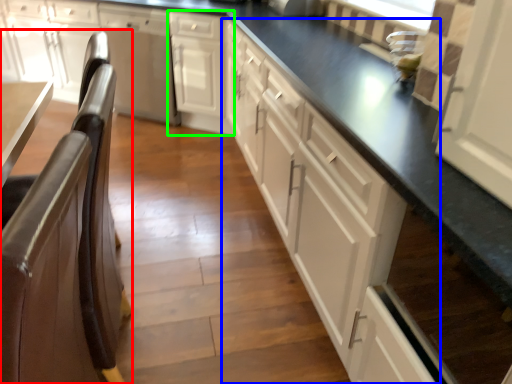
Question: Considering the real-world distances, which object is farthest from chair (highlighted by a red box)? cabinetry (highlighted by a blue box) or cabinetry (highlighted by a green box)?

Choices:
 (A) cabinetry
 (B) cabinetry

Answer: (B)